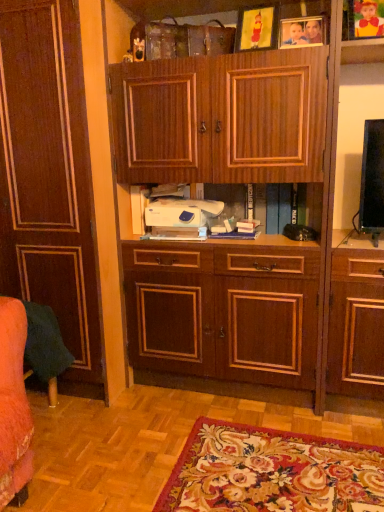
Question: Which direction should I rotate to look at wooden picture frame at upper center, positioned as the second picture frame in left-to-right order?

Choices:
 (A) right
 (B) left

Answer: (A)

Question: Does matte wood cabinet at left touch wooden picture frame at upper center, arranged as the second picture frame when viewed from the right?

Choices:
 (A) yes
 (B) no

Answer: (B)

Question: Could wooden picture frame at upper center, arranged as the second picture frame when viewed from the right, be considered to be inside matte wood cabinet at left?

Choices:
 (A) no
 (B) yes

Answer: (A)

Question: Is matte wood cabinet at left turned away from wooden picture frame at upper center, positioned as the second picture frame in left-to-right order?

Choices:
 (A) yes
 (B) no

Answer: (B)

Question: Does matte wood cabinet at left turn towards wooden picture frame at upper center, arranged as the second picture frame when viewed from the right?

Choices:
 (A) no
 (B) yes

Answer: (A)

Question: From a real-world perspective, is matte wood cabinet at left located higher than wooden picture frame at upper center, positioned as the second picture frame in left-to-right order?

Choices:
 (A) yes
 (B) no

Answer: (B)

Question: Does matte wood cabinet at left have a lesser height compared to wooden picture frame at upper center, arranged as the second picture frame when viewed from the right?

Choices:
 (A) no
 (B) yes

Answer: (A)

Question: Is white plastic printer at center at the back of wooden picture frame at upper center, positioned as the second picture frame in left-to-right order?

Choices:
 (A) yes
 (B) no

Answer: (B)

Question: Does wooden picture frame at upper center, arranged as the second picture frame when viewed from the right, appear on the left side of white plastic printer at center?

Choices:
 (A) yes
 (B) no

Answer: (B)

Question: Is wooden picture frame at upper center, arranged as the second picture frame when viewed from the right, placed right next to white plastic printer at center?

Choices:
 (A) no
 (B) yes

Answer: (A)

Question: Considering the relative sizes of wooden picture frame at upper center, arranged as the second picture frame when viewed from the right, and white plastic printer at center in the image provided, is wooden picture frame at upper center, arranged as the second picture frame when viewed from the right, wider than white plastic printer at center?

Choices:
 (A) yes
 (B) no

Answer: (B)

Question: Considering the relative sizes of wooden picture frame at upper center, arranged as the second picture frame when viewed from the right, and white plastic printer at center in the image provided, is wooden picture frame at upper center, arranged as the second picture frame when viewed from the right, thinner than white plastic printer at center?

Choices:
 (A) no
 (B) yes

Answer: (B)

Question: Is wooden picture frame at upper center, positioned as the second picture frame in left-to-right order, located outside white plastic printer at center?

Choices:
 (A) no
 (B) yes

Answer: (B)

Question: Is yellow paper picture frame at upper center, the 3th picture frame when ordered from right to left, turned away from wooden picture frame at upper center, positioned as the second picture frame in left-to-right order?

Choices:
 (A) yes
 (B) no

Answer: (B)